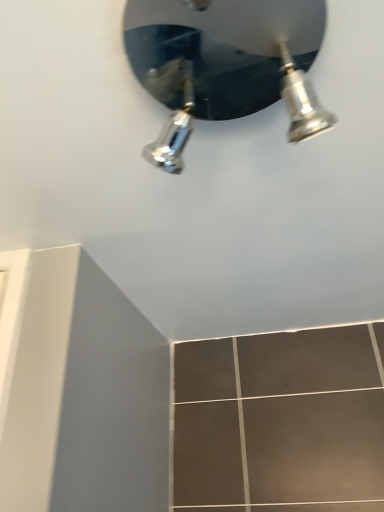
What do you see at coordinates (225, 64) in the screenshot? The image size is (384, 512). I see `chrome metallic light fixture at upper center` at bounding box center [225, 64].

In order to click on chrome metallic light fixture at upper center in this screenshot , I will do `click(225, 64)`.

At what (x,y) coordinates should I click in order to perform the action: click on chrome metallic light fixture at upper center. Please return your answer as a coordinate pair (x, y). Looking at the image, I should click on (225, 64).